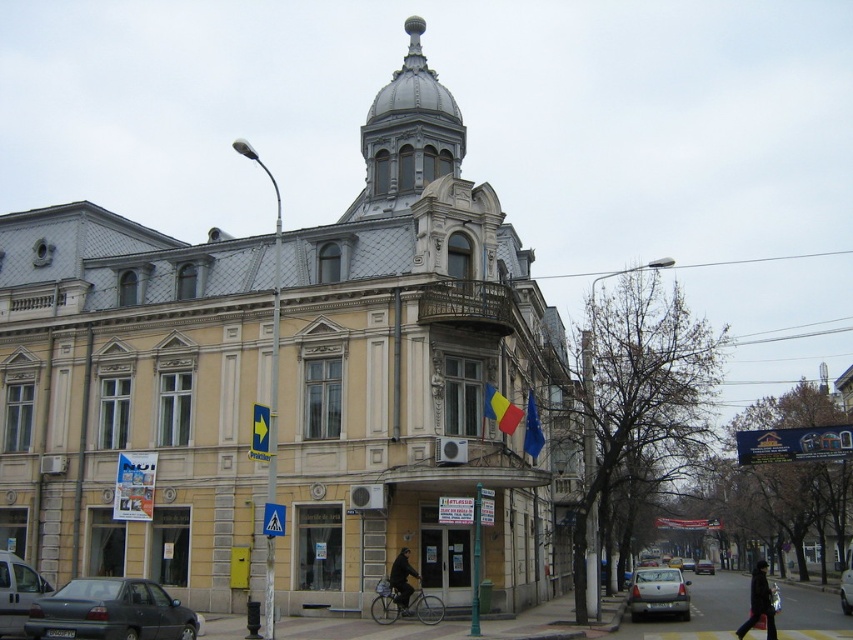
You are a pedestrian standing at the crosswalk and want to reach the blue fabric flag at center. Which direction should you walk to avoid the silver metallic car at center?

The silver metallic car at center is to the right of the blue fabric flag at center, so you should walk to the left to avoid the silver metallic car at center and reach the blue fabric flag at center.

You are standing at the pedestrian crossing sign and want to cross the street to reach the ornate building. The silver metallic car at center is blocking your path. Can you safely walk around it if the car is 63.73 meters away from you?

The silver metallic car at center is 63.73 meters away from you, so yes, you can safely walk around it since it is far enough to allow passage without obstruction.

You are standing at the pedestrian crossing sign in the street scene. You see two points marked on the ground ahead of you, labeled as point 1 at coordinates point (666,595) and point 2 at coordinates point (497,410). Which point is closer to you?

Point 2 at coordinates point (497,410) is closer to you because point 1 at coordinates point (666,595) is behind point 2.